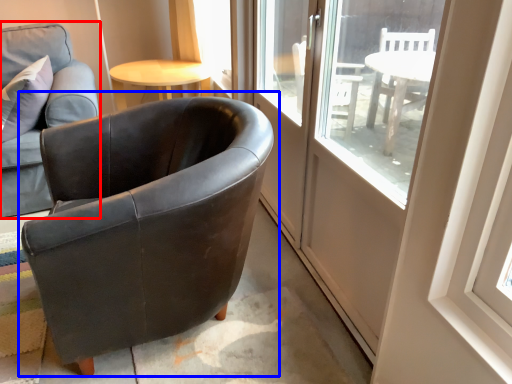
Question: Which point is further to the camera, chair (highlighted by a red box) or chair (highlighted by a blue box)?

Choices:
 (A) chair
 (B) chair

Answer: (A)